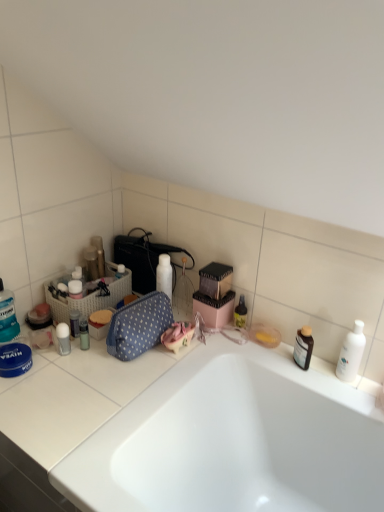
Where is `vacant area in front of translucent plastic tube at left, the 3th toiletry in the left-to-right sequence`? vacant area in front of translucent plastic tube at left, the 3th toiletry in the left-to-right sequence is located at coordinates (62, 369).